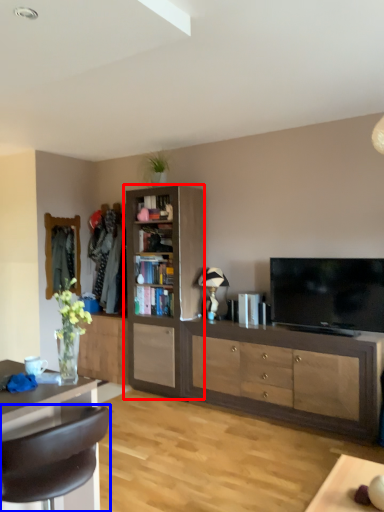
Question: Which object appears farthest to the camera in this image, cabinetry (highlighted by a red box) or chair (highlighted by a blue box)?

Choices:
 (A) cabinetry
 (B) chair

Answer: (A)